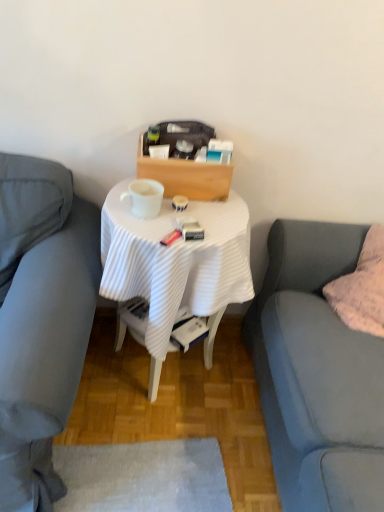
Where is `free location in front of white glossy mug at center`? The height and width of the screenshot is (512, 384). free location in front of white glossy mug at center is located at coordinates (143, 228).